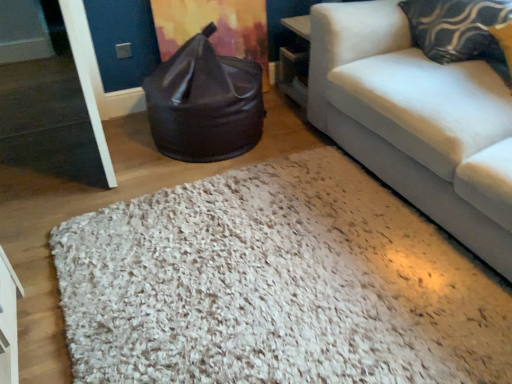
At what (x,y) coordinates should I click in order to perform the action: click on free point to the right of black leather bean bag at center. Please return your answer as a coordinate pair (x, y). Looking at the image, I should click on (286, 131).